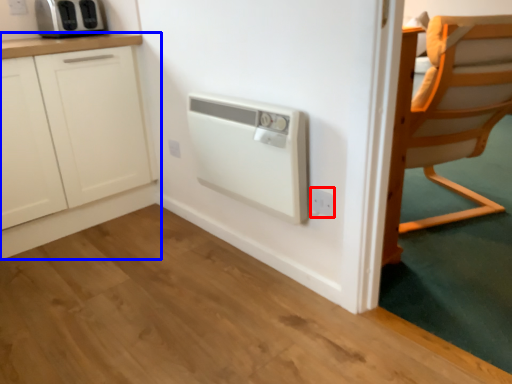
Question: Which object appears farthest to the camera in this image, electric outlet (highlighted by a red box) or cabinetry (highlighted by a blue box)?

Choices:
 (A) electric outlet
 (B) cabinetry

Answer: (B)